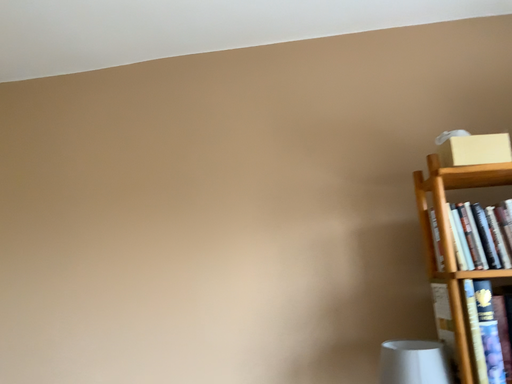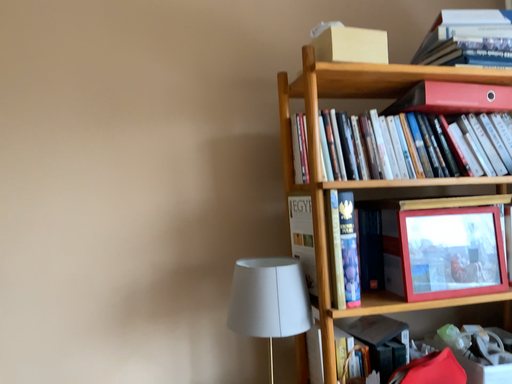
Question: Which way did the camera rotate in the video?

Choices:
 (A) rotated right
 (B) rotated left

Answer: (A)